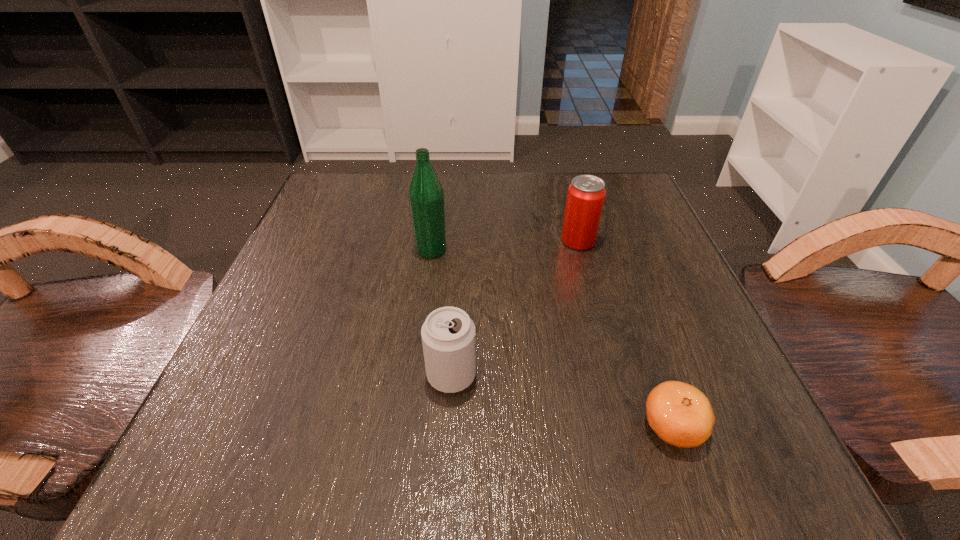
Find the location of a particular element. free space at the far right corner of the desktop is located at coordinates (644, 226).

Identify the location of free space at the near right corner of the desktop. 732,451.

Find the location of a particular element. The height and width of the screenshot is (540, 960). vacant area between the bottle and the farther can is located at coordinates (505, 245).

In order to click on free space between the farther can and the bottle in this screenshot , I will do `click(505, 245)`.

Image resolution: width=960 pixels, height=540 pixels. Find the location of `empty location between the bottle and the right can`. empty location between the bottle and the right can is located at coordinates (505, 245).

Locate an element on the screen. This screenshot has width=960, height=540. free space between the farther can and the nearest object is located at coordinates (625, 334).

Identify the location of vacant area that lies between the bottle and the farther can. This screenshot has height=540, width=960. (505, 245).

In order to click on vacant space that is in between the farther can and the left can in this screenshot , I will do `click(515, 308)`.

At what (x,y) coordinates should I click in order to perform the action: click on vacant space that's between the tallest object and the nearest object. Please return your answer as a coordinate pair (x, y). The width and height of the screenshot is (960, 540). Looking at the image, I should click on (552, 338).

Identify the location of free space between the farther can and the nearer can. The height and width of the screenshot is (540, 960). (515, 308).